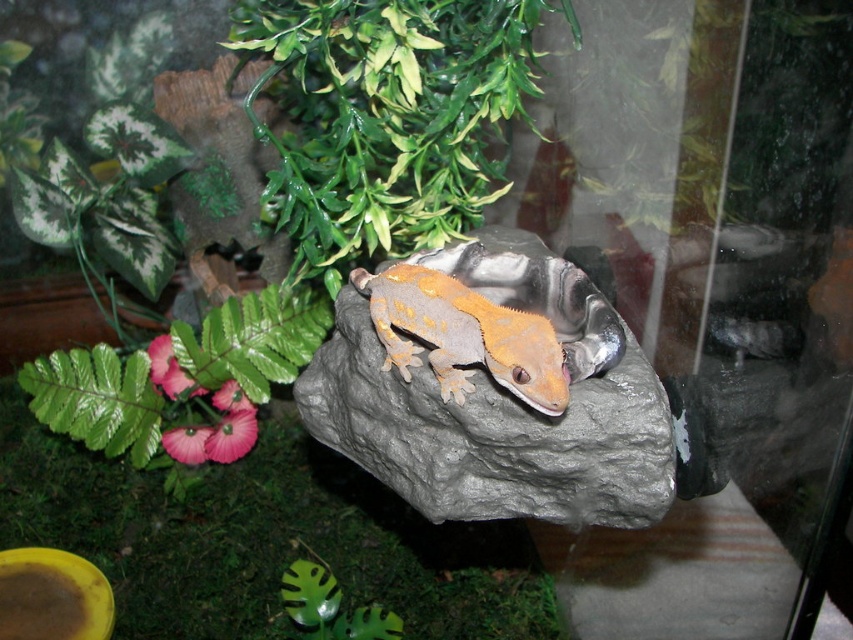
You are a small insect in the terrarium. You want to crawl from the gray matte rock at center to the green leafy plant at upper center. Which direction should you move towards?

The gray matte rock at center is behind the green leafy plant at upper center, so you should move forward towards the green leafy plant at upper center.

You are a small toy car that is 10 cm tall. You want to drive under the green leafy plant at lower left and the orange matte lizard at center without hitting your roof. Which one can you safely pass under?

The green leafy plant at lower left is taller than the orange matte lizard at center, so the toy car can safely pass under the orange matte lizard at center since it is shorter than the car height of 10 cm.